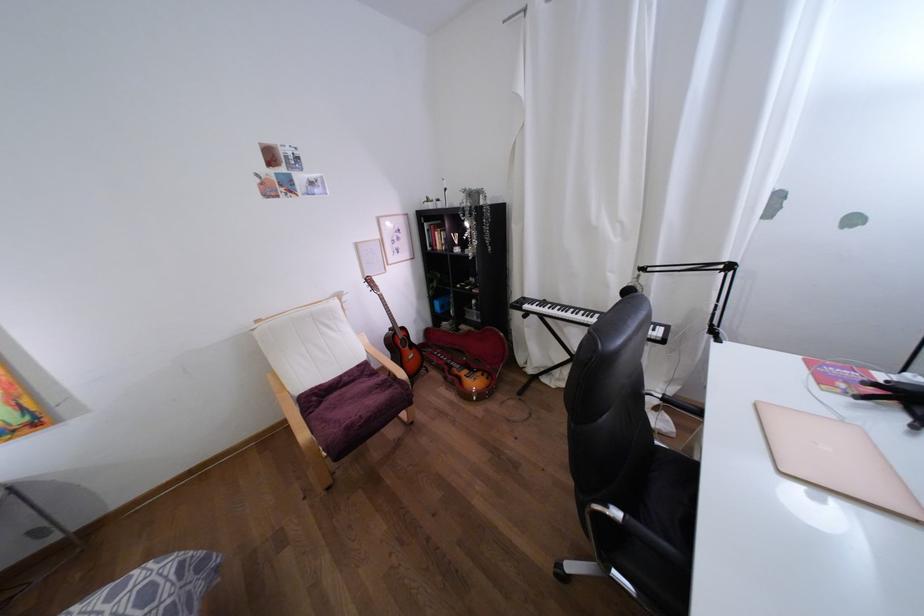
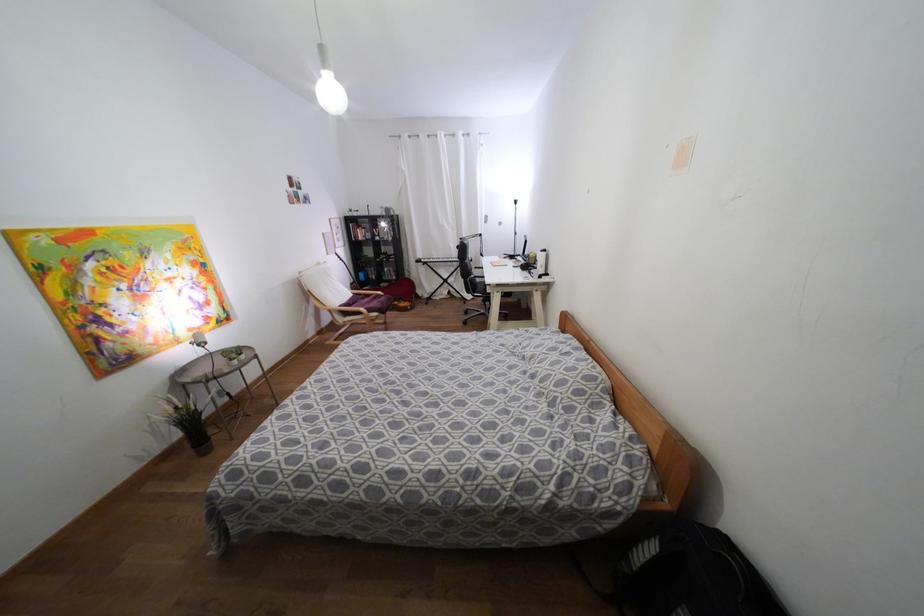
Locate, in the second image, the point that corresponds to pixel 438 246 in the first image.

(359, 238)